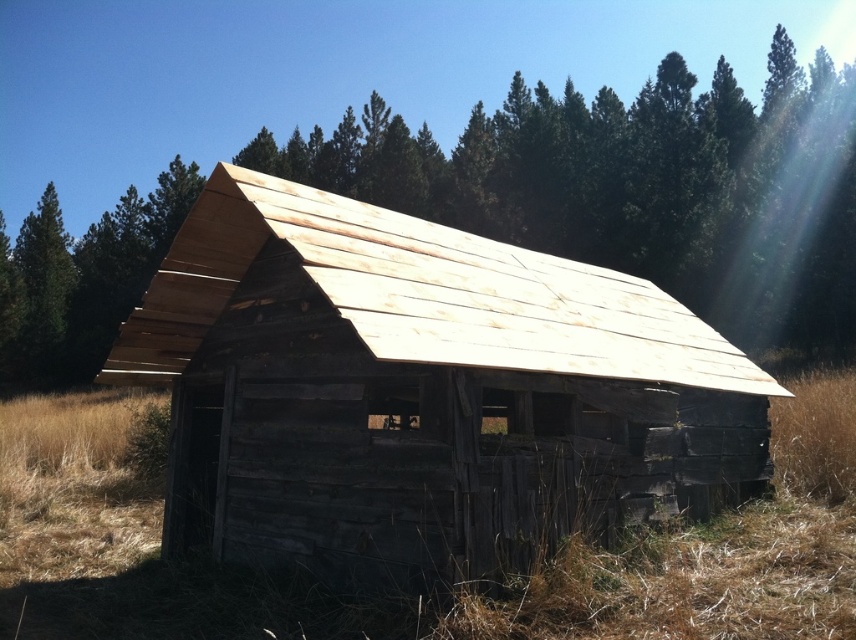
Question: Is weathered wood barn at center closer to the viewer compared to brown wooden roof at center?

Choices:
 (A) yes
 (B) no

Answer: (A)

Question: Is weathered wood barn at center wider than brown wooden roof at center?

Choices:
 (A) no
 (B) yes

Answer: (A)

Question: Which object is closer to the camera taking this photo?

Choices:
 (A) weathered wood barn at center
 (B) brown wooden roof at center

Answer: (A)

Question: Can you confirm if weathered wood barn at center is positioned above brown wooden roof at center?

Choices:
 (A) no
 (B) yes

Answer: (A)